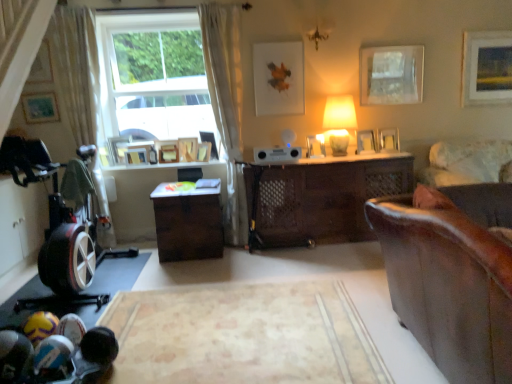
The height and width of the screenshot is (384, 512). I want to click on free spot below beige carpet at center (from a real-world perspective), so click(251, 328).